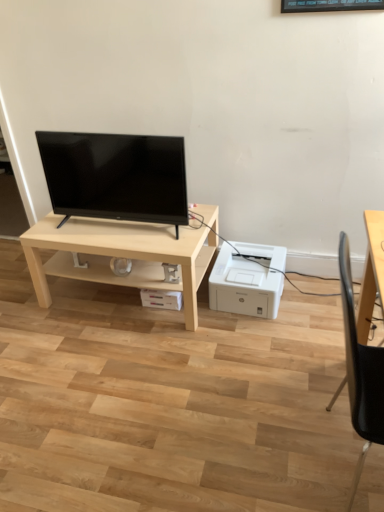
Where is `free space in front of light wood table at center`? The image size is (384, 512). free space in front of light wood table at center is located at coordinates pyautogui.click(x=132, y=372).